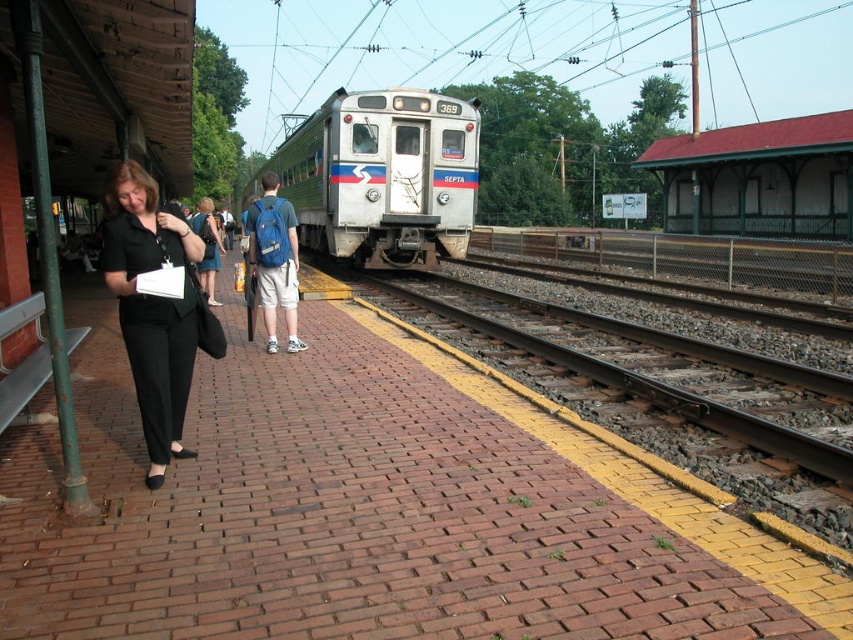
Question: Is black matte pants at left below blue backpack at center?

Choices:
 (A) yes
 (B) no

Answer: (A)

Question: Does silver metallic train at center appear on the left side of denim shorts at center?

Choices:
 (A) no
 (B) yes

Answer: (A)

Question: Can you confirm if blue backpack at center is positioned to the right of denim shorts at center?

Choices:
 (A) no
 (B) yes

Answer: (B)

Question: Which of these objects is positioned farthest from the denim shorts at center?

Choices:
 (A) black matte pants at left
 (B) smooth metal train track at center
 (C) silver metallic train at center

Answer: (C)

Question: Which point is closer to the camera?

Choices:
 (A) (291, 221)
 (B) (436, 193)
 (C) (746, 429)
 (D) (155, 424)

Answer: (D)

Question: Which object is positioned farthest from the black matte pants at left?

Choices:
 (A) smooth metal train track at center
 (B) blue backpack at center
 (C) silver metallic train at center

Answer: (C)